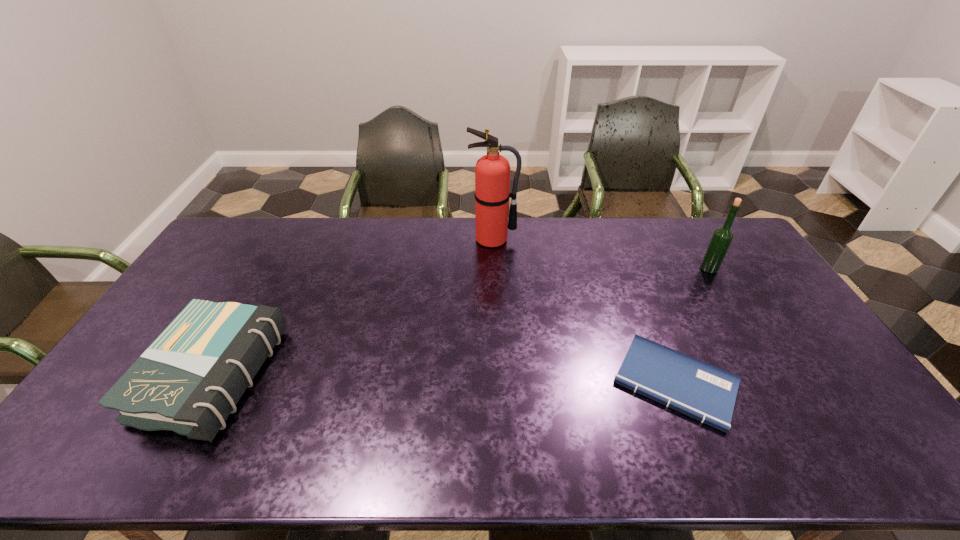
You are a GUI agent. You are given a task and a screenshot of the screen. Output one action in this format:
    pyautogui.click(x=<x>, y=<y>)
    Task: Click on the vacant region at the far left corner of the desktop
    This screenshot has width=960, height=540.
    Given the screenshot: What is the action you would take?
    pyautogui.click(x=258, y=225)

Locate an element on the screen. free space between the shortest object and the second shortest object is located at coordinates (444, 380).

This screenshot has height=540, width=960. In order to click on unoccupied area between the rightmost object and the second shortest object in this screenshot , I will do `click(460, 322)`.

Where is `empty space between the rightmost object and the taller paperback book`? The image size is (960, 540). empty space between the rightmost object and the taller paperback book is located at coordinates (460, 322).

The width and height of the screenshot is (960, 540). In order to click on vacant region between the shorter paperback book and the rightmost object in this screenshot , I will do [692, 326].

Where is `vacant space that is in between the farthest object and the second shortest object`? The height and width of the screenshot is (540, 960). vacant space that is in between the farthest object and the second shortest object is located at coordinates (352, 308).

I want to click on free area in between the fire extinguisher and the third shortest object, so click(x=601, y=254).

Locate an element on the screen. free point between the taller paperback book and the tallest object is located at coordinates (352, 308).

Identify the location of vacant area between the rightmost object and the third object from left to right. (692, 326).

The width and height of the screenshot is (960, 540). I want to click on vacant space that's between the shortest object and the third nearest object, so click(x=692, y=326).